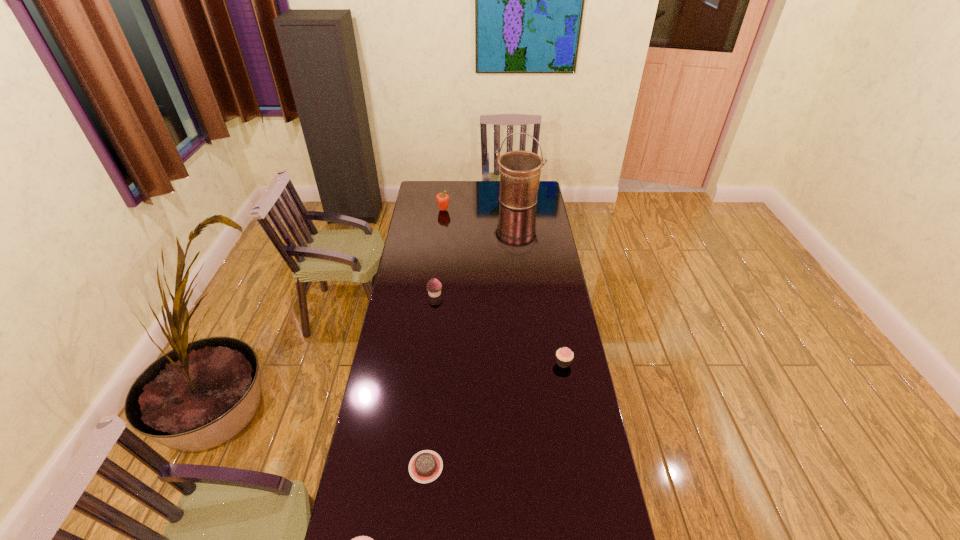
In order to click on free region located on the back of the fourth nearest object in this screenshot , I will do `click(437, 280)`.

At what (x,y) coordinates should I click in order to perform the action: click on blank space located 0.160m on the front of the third nearest object. Please return your answer as a coordinate pair (x, y). Looking at the image, I should click on (571, 406).

Find the location of a particular element. Image resolution: width=960 pixels, height=540 pixels. vacant space located 0.260m on the right of the fifth farthest object is located at coordinates (x=522, y=467).

Identify the location of object at the far edge. The image size is (960, 540). (520, 171).

Where is `pepper that is at the left edge`? pepper that is at the left edge is located at coordinates (442, 199).

Locate an element on the screen. cupcake that is at the left edge is located at coordinates (434, 287).

Find the location of a particular element. bucket positioned at the right edge is located at coordinates (520, 171).

At what (x,y) coordinates should I click in order to perform the action: click on cupcake positioned at the right edge. Please return your answer as a coordinate pair (x, y). This screenshot has width=960, height=540. Looking at the image, I should click on (564, 356).

You are a GUI agent. You are given a task and a screenshot of the screen. Output one action in this format:
    pyautogui.click(x=<x>, y=<y>)
    Task: Click on the object located in the far right corner section of the desktop
    Image resolution: width=960 pixels, height=540 pixels.
    Given the screenshot: What is the action you would take?
    pyautogui.click(x=520, y=171)

In the image, there is a desktop. At what (x,y) coordinates should I click in order to perform the action: click on vacant space at the left edge. Please return your answer as a coordinate pair (x, y). This screenshot has height=540, width=960. Looking at the image, I should click on (396, 399).